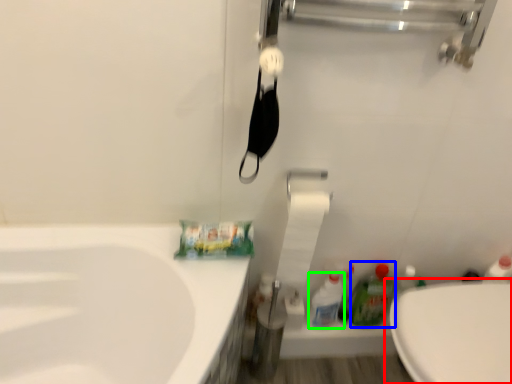
Question: Estimate the real-world distances between objects in this image. Which object is closer to toilet (highlighted by a red box), cleaning product (highlighted by a blue box) or cleaning product (highlighted by a green box)?

Choices:
 (A) cleaning product
 (B) cleaning product

Answer: (A)